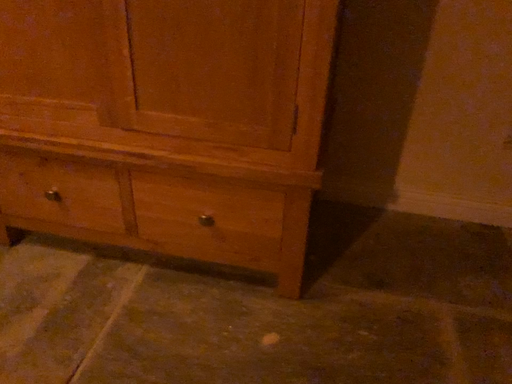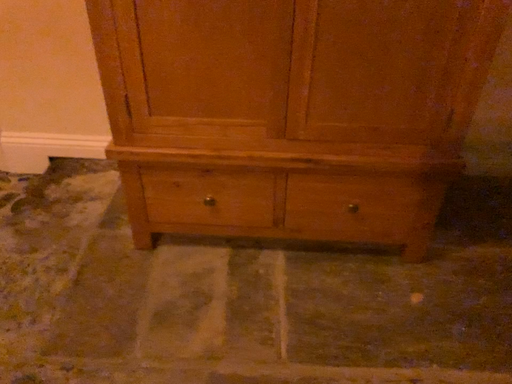
Question: How did the camera likely rotate when shooting the video?

Choices:
 (A) rotated right
 (B) rotated left

Answer: (A)